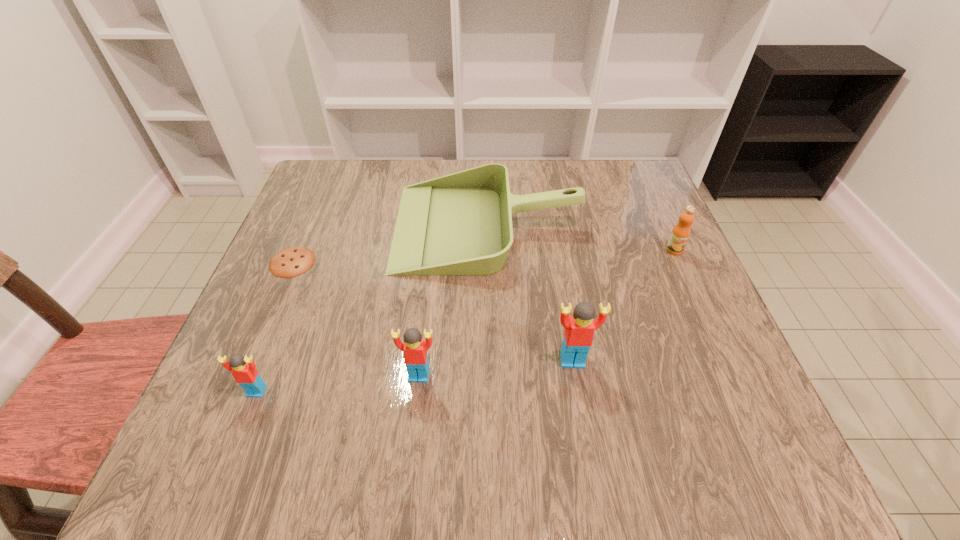
The Legos are evenly distributed in the image. To maintain this, where would you place another Lego on the right? Please point to a free space. Please provide its 2D coordinates. Your answer should be formatted as a tuple, i.e. [(x, y)], where the tuple contains the x and y coordinates of a point satisfying the conditions above.

[(718, 346)]